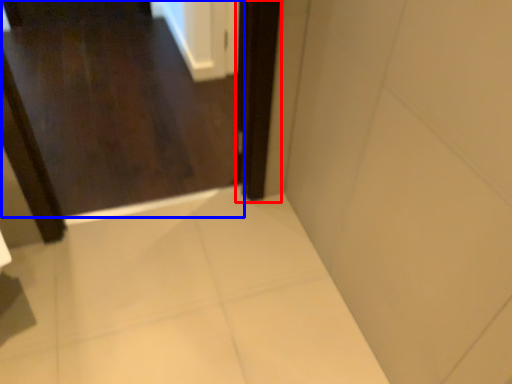
Question: Which point is further to the camera, screen door (highlighted by a red box) or door (highlighted by a blue box)?

Choices:
 (A) screen door
 (B) door

Answer: (B)